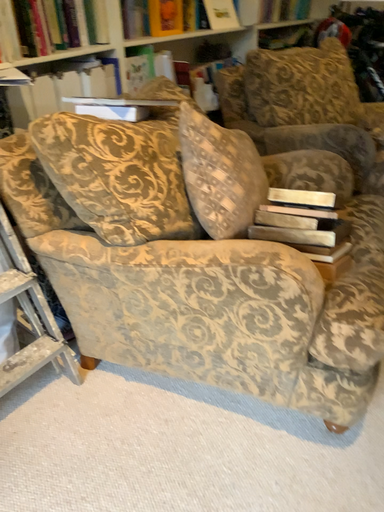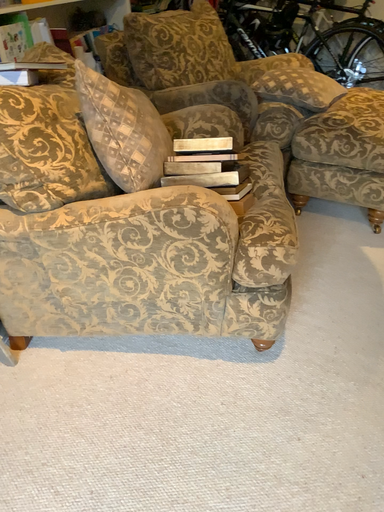
Question: How did the camera likely rotate when shooting the video?

Choices:
 (A) rotated right
 (B) rotated left

Answer: (A)